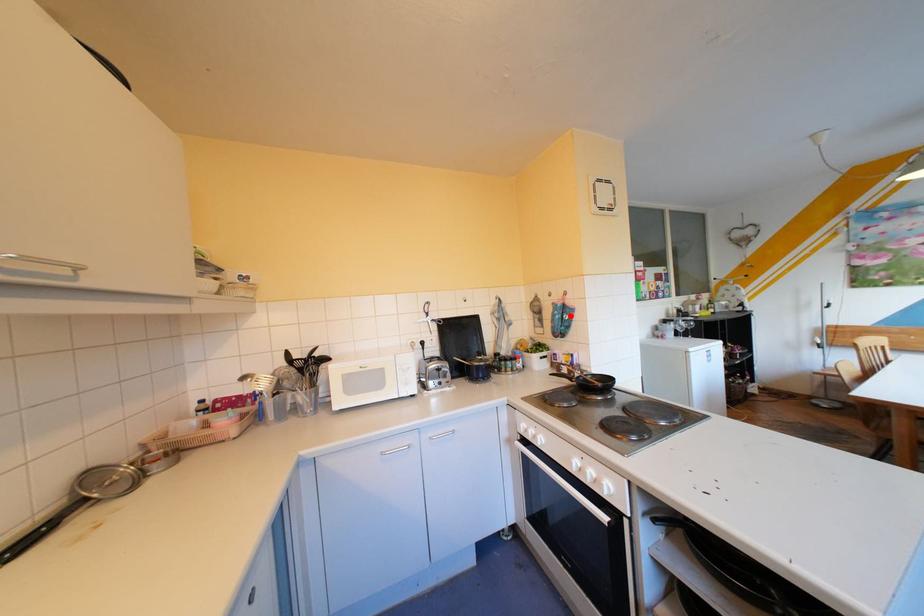
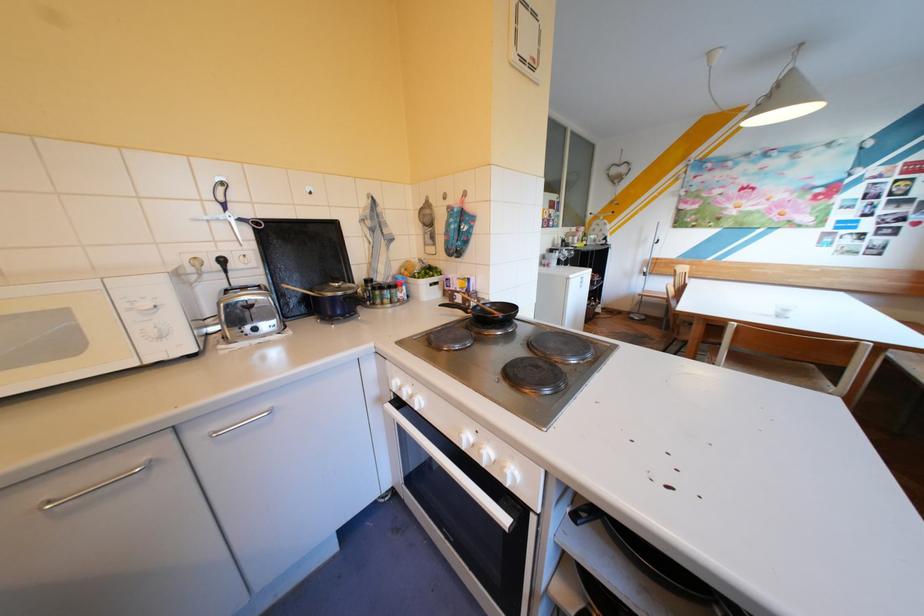
Where in the second image is the point corresponding to the highlighted location from the first image?

(466, 225)